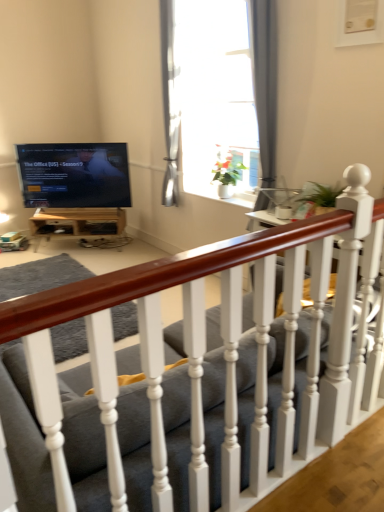
What is the approximate width of matte gray fabric couch at center?

39.34 inches.

The image size is (384, 512). What are the coordinates of `matte black tv at upper left` in the screenshot? It's located at (74, 175).

Identify the location of matte gray fabric couch at center. This screenshot has height=512, width=384. (194, 398).

Would you consider matte black tv at upper left to be distant from white glossy window at upper center?

matte black tv at upper left is far away from white glossy window at upper center.

Between matte black tv at upper left and white glossy window at upper center, which one has more height?

Standing taller between the two is white glossy window at upper center.

From a real-world perspective, between matte black tv at upper left and white glossy window at upper center, who is vertically higher?

In real-world perspective, white glossy window at upper center is above.

From the image's perspective, which one is positioned lower, matte black tv at upper left or white glossy window at upper center?

matte black tv at upper left appears lower in the image.

Is there a large distance between white glossy window at upper center and wooden table at lower left?

Indeed, white glossy window at upper center is not near wooden table at lower left.

Which is in front, white glossy window at upper center or wooden table at lower left?

white glossy window at upper center.

At what (x,y) coordinates should I click in order to perform the action: click on window above the wooden table at lower left (from a real-world perspective). Please return your answer as a coordinate pair (x, y). Looking at the image, I should click on (265, 81).

Based on their positions, is white glossy window at upper center located to the left or right of wooden table at lower left?

Clearly, white glossy window at upper center is on the right of wooden table at lower left in the image.

Would you consider matte gray fabric couch at center to be distant from white glossy window at upper center?

Yes.

From the image's perspective, is matte gray fabric couch at center located beneath white glossy window at upper center?

Yes, from the image's perspective, matte gray fabric couch at center is beneath white glossy window at upper center.

Is matte gray fabric couch at center positioned in front of white glossy window at upper center?

Yes, it is in front of white glossy window at upper center.

Can you confirm if matte gray fabric couch at center is bigger than white glossy window at upper center?

Yes.

Is white glossy window at upper center with matte gray fabric couch at center?

No.

From their relative heights in the image, would you say white glossy window at upper center is taller or shorter than matte gray fabric couch at center?

In the image, white glossy window at upper center appears to be taller than matte gray fabric couch at center.

Considering the points (258, 85) and (255, 426), which point is behind, point (258, 85) or point (255, 426)?

The point (258, 85) is farther.

Considering the sizes of white glossy window at upper center and matte gray fabric couch at center in the image, is white glossy window at upper center wider or thinner than matte gray fabric couch at center?

In the image, white glossy window at upper center appears to be more narrow than matte gray fabric couch at center.

Which is more to the right, white glossy window at upper center or matte black tv at upper left?

white glossy window at upper center is more to the right.

Which object is further away from the camera taking this photo, white glossy window at upper center or matte black tv at upper left?

matte black tv at upper left is more distant.

Considering the positions of point (165, 62) and point (68, 197), is point (165, 62) closer or farther from the camera than point (68, 197)?

Clearly, point (165, 62) is closer to the camera than point (68, 197).

Is white glossy window at upper center beside matte black tv at upper left?

No, white glossy window at upper center is not next to matte black tv at upper left.

Does matte black tv at upper left have a lesser width compared to matte gray fabric couch at center?

Yes, matte black tv at upper left is thinner than matte gray fabric couch at center.

Which is more to the left, matte black tv at upper left or matte gray fabric couch at center?

Positioned to the left is matte black tv at upper left.

Which is behind, point (43, 177) or point (210, 496)?

The point (43, 177) is more distant.

At what (x,y) coordinates should I click in order to perform the action: click on studio couch located underneath the matte black tv at upper left (from a real-world perspective). Please return your answer as a coordinate pair (x, y). The width and height of the screenshot is (384, 512). Looking at the image, I should click on (194, 398).

Which is in front, point (163, 384) or point (64, 229)?

Positioned in front is point (163, 384).

Is matte gray fabric couch at center facing away from wooden table at lower left?

That's not correct — matte gray fabric couch at center is not looking away from wooden table at lower left.

Is matte gray fabric couch at center next to wooden table at lower left and touching it?

They are not placed beside each other.

From a real-world perspective, is matte gray fabric couch at center above or below wooden table at lower left?

matte gray fabric couch at center is above wooden table at lower left.

Locate an element on the screen. television that is under the white glossy window at upper center (from a real-world perspective) is located at coordinates (74, 175).

Where is `table that is below the white glossy window at upper center (from the image's perspective)`? The image size is (384, 512). table that is below the white glossy window at upper center (from the image's perspective) is located at coordinates (77, 222).

When comparing their distances from wooden table at lower left, does matte gray fabric couch at center or matte black tv at upper left seem further?

The object further to wooden table at lower left is matte gray fabric couch at center.

From the image, which object appears to be farther from matte gray fabric couch at center, white glossy window at upper center or matte black tv at upper left?

matte black tv at upper left lies further to matte gray fabric couch at center than the other object.

Looking at the image, which one is located closer to wooden table at lower left, matte black tv at upper left or white glossy window at upper center?

Among the two, matte black tv at upper left is located nearer to wooden table at lower left.

From the image, which object appears to be nearer to matte gray fabric couch at center, matte black tv at upper left or white glossy window at upper center?

white glossy window at upper center is positioned closer to the anchor matte gray fabric couch at center.

Considering their positions, is wooden table at lower left positioned further to white glossy window at upper center than matte gray fabric couch at center?

The object further to white glossy window at upper center is matte gray fabric couch at center.

When comparing their distances from matte gray fabric couch at center, does white glossy window at upper center or wooden table at lower left seem further?

Among the two, wooden table at lower left is located further to matte gray fabric couch at center.

Estimate the real-world distances between objects in this image. Which object is further from wooden table at lower left, matte gray fabric couch at center or white glossy window at upper center?

matte gray fabric couch at center lies further to wooden table at lower left than the other object.

Considering their positions, is wooden table at lower left positioned further to white glossy window at upper center than matte black tv at upper left?

Based on the image, wooden table at lower left appears to be further to white glossy window at upper center.

This screenshot has width=384, height=512. In order to click on television between matte gray fabric couch at center and wooden table at lower left along the z-axis in this screenshot , I will do `click(74, 175)`.

Identify the location of table located between matte black tv at upper left and white glossy window at upper center in the left-right direction. The width and height of the screenshot is (384, 512). (77, 222).

Find the location of a particular element. The image size is (384, 512). window between matte gray fabric couch at center and wooden table at lower left from front to back is located at coordinates (265, 81).

Where is `window between matte gray fabric couch at center and matte black tv at upper left along the z-axis`? The height and width of the screenshot is (512, 384). window between matte gray fabric couch at center and matte black tv at upper left along the z-axis is located at coordinates (265, 81).